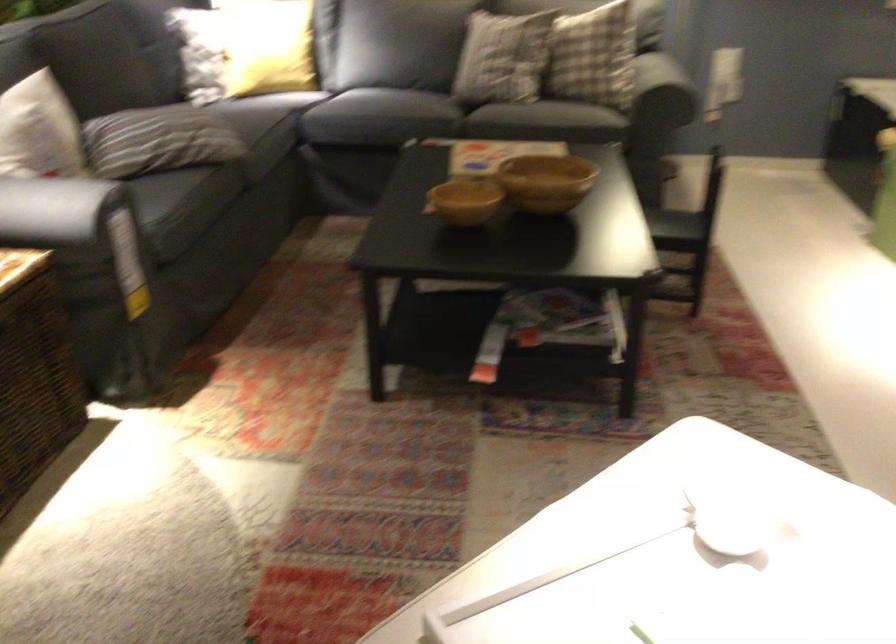
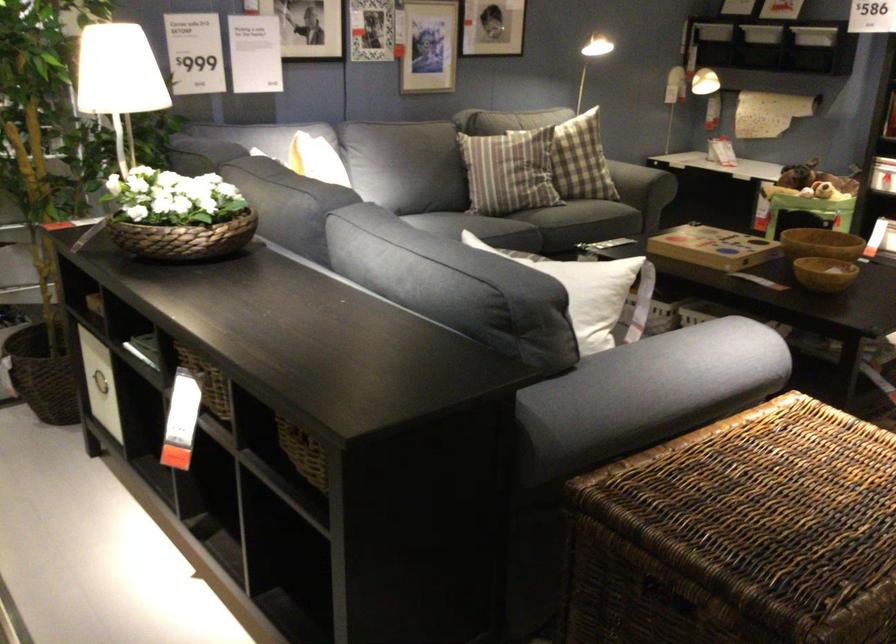
Locate, in the second image, the point that corresponds to [505,169] in the first image.

(821, 243)